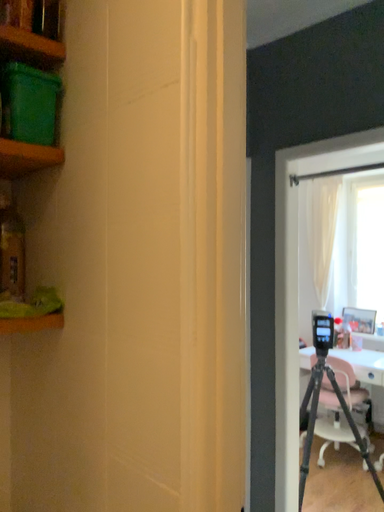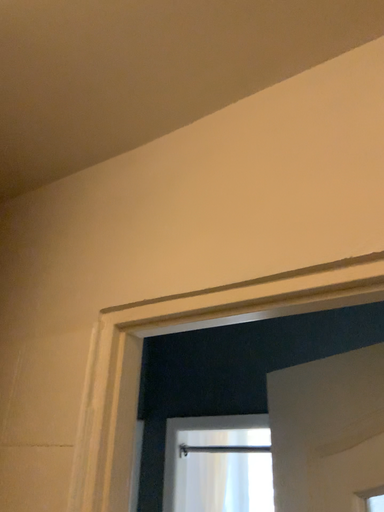
Question: Which way did the camera rotate in the video?

Choices:
 (A) rotated right
 (B) rotated left

Answer: (A)